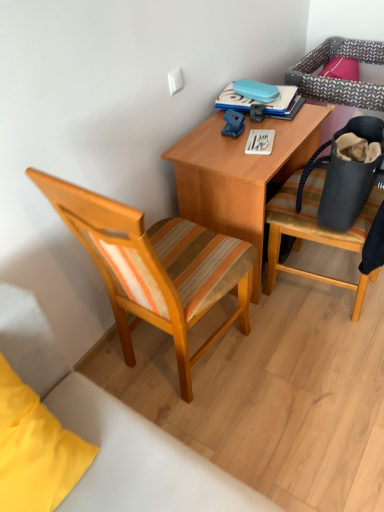
Identify the location of vacant space in front of wooden desk at center. This screenshot has height=512, width=384. (299, 350).